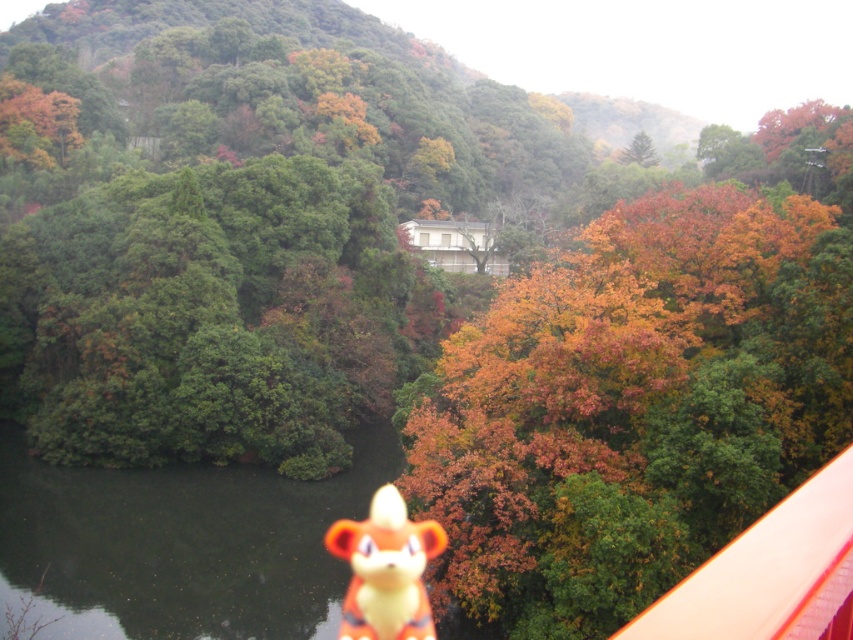
You are a hiker who has just spotted the autumn leaves at center and the orange plush toy at center in the forest. Which object is positioned to the right of the other?

The autumn leaves at center are to the right of the orange plush toy at center.

Consider the image. You are a hiker who just found a orange plush toy at center in a forest. You want to place it near autumn leaves at center to make it look more natural. Is the distance between them sufficient for you to carry the toy to the leaves without needing to go around any obstacles?

The distance between autumn leaves at center and orange plush toy at center is 32.12 feet, so yes, you can easily carry the orange plush toy at center to the autumn leaves at center without needing to go around any obstacles as there are no mentioned obstacles in the scene.